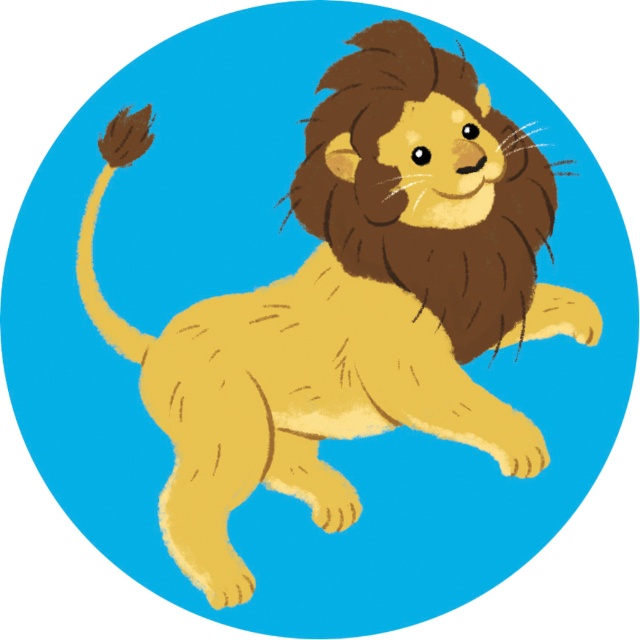
Question: Does brown fuzzy mane at center have a larger size compared to brown fuzzy tail at upper left?

Choices:
 (A) no
 (B) yes

Answer: (B)

Question: Can you confirm if brown fuzzy mane at center is positioned to the right of brown fuzzy tail at upper left?

Choices:
 (A) no
 (B) yes

Answer: (B)

Question: Which point is farther to the camera?

Choices:
 (A) brown fuzzy tail at upper left
 (B) brown fuzzy mane at center

Answer: (A)

Question: In this image, where is brown fuzzy mane at center located relative to brown fuzzy tail at upper left?

Choices:
 (A) left
 (B) right

Answer: (B)